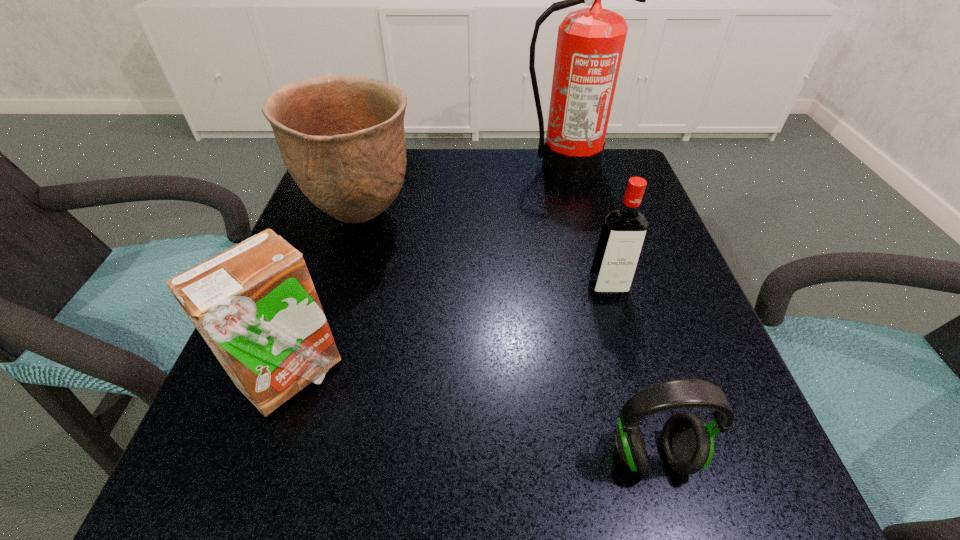
You are a GUI agent. You are given a task and a screenshot of the screen. Output one action in this format:
    pyautogui.click(x=<x>, y=<y>)
    Task: Click on the object that is at the far right corner
    The width and height of the screenshot is (960, 540).
    Given the screenshot: What is the action you would take?
    pyautogui.click(x=590, y=42)

The image size is (960, 540). I want to click on object that is positioned at the near right corner, so click(687, 444).

Where is `vacant area at the far edge`? The height and width of the screenshot is (540, 960). vacant area at the far edge is located at coordinates (433, 172).

In the image, there is a desktop. Identify the location of vacant space at the near edge. (613, 451).

I want to click on free region at the left edge of the desktop, so click(x=351, y=313).

The width and height of the screenshot is (960, 540). Identify the location of free region at the right edge. pos(633,332).

At what (x,y) coordinates should I click in order to perform the action: click on free spot between the farthest object and the vodka. Please return your answer as a coordinate pair (x, y). The height and width of the screenshot is (540, 960). Looking at the image, I should click on (587, 227).

Where is `free space that is in between the fourth nearest object and the fire extinguisher`? The image size is (960, 540). free space that is in between the fourth nearest object and the fire extinguisher is located at coordinates (464, 192).

The width and height of the screenshot is (960, 540). Find the location of `free area in between the fourth farthest object and the headset`. free area in between the fourth farthest object and the headset is located at coordinates (471, 415).

Where is `free space between the pottery and the third nearest object`? free space between the pottery and the third nearest object is located at coordinates (485, 253).